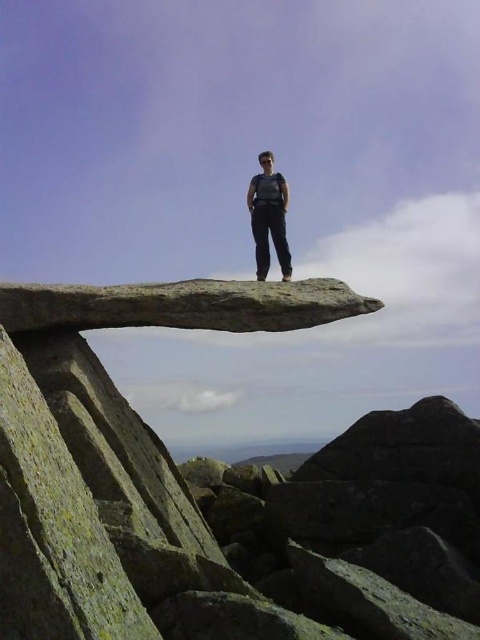
From the picture: You are a hiker planning to stand on the gray rough rock at center. Based on the coordinates provided, can you confirm if the point marked by point (218, 492) is the correct location for the gray rough rock at center?

Yes, the point (218, 492) marks the gray rough rock at center according to the provided coordinates.

You are a photographer planning to capture the silhouette of the gray rough rock at center and the matte black pants at center against the sky. Which object should you focus on first to ensure it appears larger in your photo?

The gray rough rock at center has a greater height compared to the matte black pants at center, so you should focus on the gray rough rock at center first to ensure it appears larger in the photo.